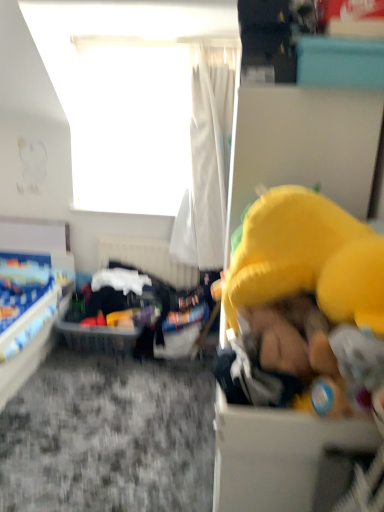
Identify the location of free region under transparent plastic window screen at upper center (from a real-world perspective). (130, 203).